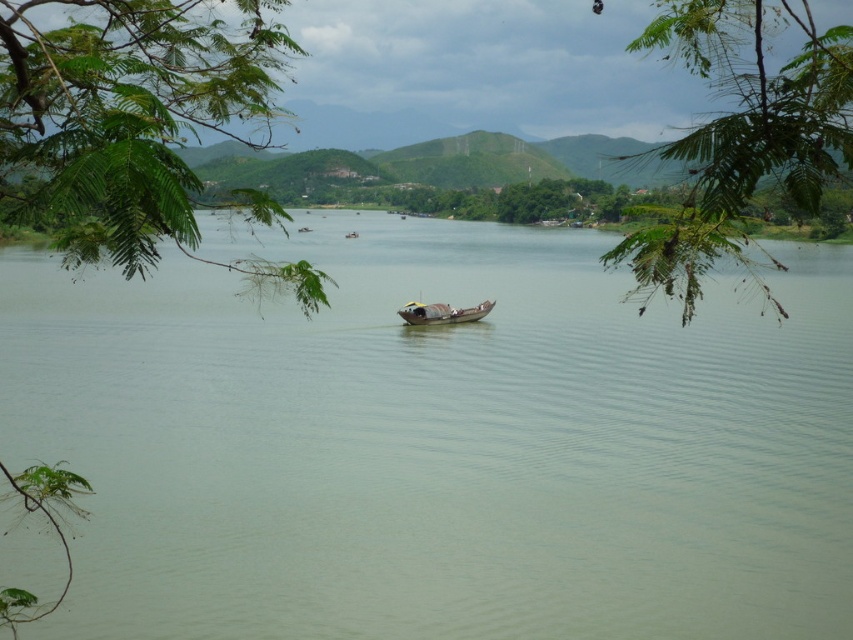
Question: Estimate the real-world distances between objects in this image. Which object is farther from the green leafy branch at upper center?

Choices:
 (A) green leafy branch at upper left
 (B) rusty metal boat at center
 (C) green matte water at center

Answer: (B)

Question: Which point is farther from the camera taking this photo?

Choices:
 (A) (444, 321)
 (B) (0, 173)
 (C) (306, 634)

Answer: (A)

Question: Is green matte water at center above green leafy branch at upper center?

Choices:
 (A) yes
 (B) no

Answer: (B)

Question: Is green leafy branch at upper left further to the viewer compared to rusty metal boat at center?

Choices:
 (A) no
 (B) yes

Answer: (A)

Question: Is green matte water at center thinner than rusty metal boat at center?

Choices:
 (A) yes
 (B) no

Answer: (B)

Question: Based on their relative distances, which object is nearer to the green leafy branch at upper left?

Choices:
 (A) green matte water at center
 (B) rusty metal boat at center
 (C) green leafy branch at upper center

Answer: (A)